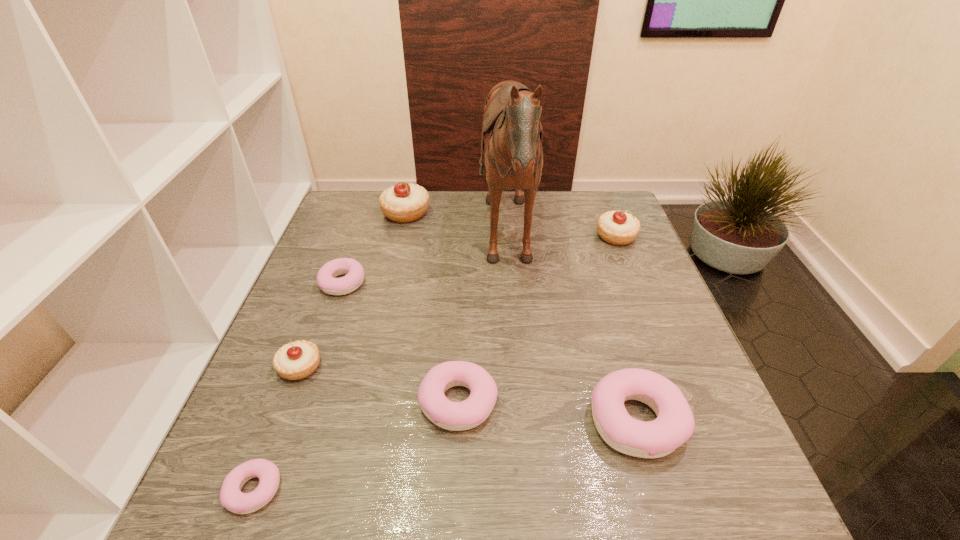
Find the location of `brown saddle`. brown saddle is located at coordinates (512, 132).

You are a GUI agent. You are given a task and a screenshot of the screen. Output one action in this format:
    pyautogui.click(x=<x>, y=<y>)
    Task: Click on the saddle
    The width and height of the screenshot is (960, 540).
    Given the screenshot: What is the action you would take?
    pyautogui.click(x=512, y=132)

Find the location of `the biggest beige pastry`. the biggest beige pastry is located at coordinates (403, 203).

Where is `the second beige pastry from left to right`? The width and height of the screenshot is (960, 540). the second beige pastry from left to right is located at coordinates (403, 203).

Locate an element on the screen. Image resolution: width=960 pixels, height=540 pixels. the rightmost beige pastry is located at coordinates (619, 228).

Locate an element on the screen. Image resolution: width=960 pixels, height=540 pixels. the second smallest beige pastry is located at coordinates (619, 228).

The width and height of the screenshot is (960, 540). Find the location of `the nearest beige pastry`. the nearest beige pastry is located at coordinates (297, 360).

What are the coordinates of `the leftmost beige pastry` in the screenshot? It's located at (297, 360).

Identify the location of the biggest pink pastry. The image size is (960, 540). (674, 425).

Locate an element on the screen. the second biggest pink pastry is located at coordinates click(456, 416).